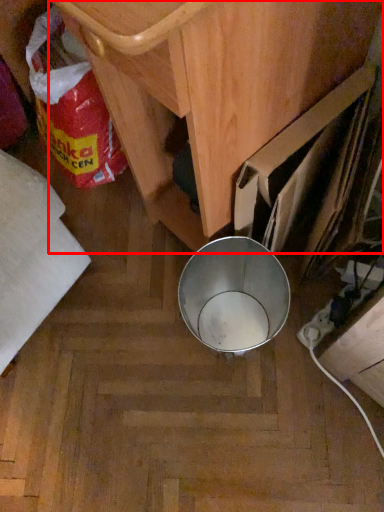
Question: From the image, what is the correct spatial relationship of furniture (annotated by the red box) in relation to waste?

Choices:
 (A) right
 (B) left

Answer: (A)